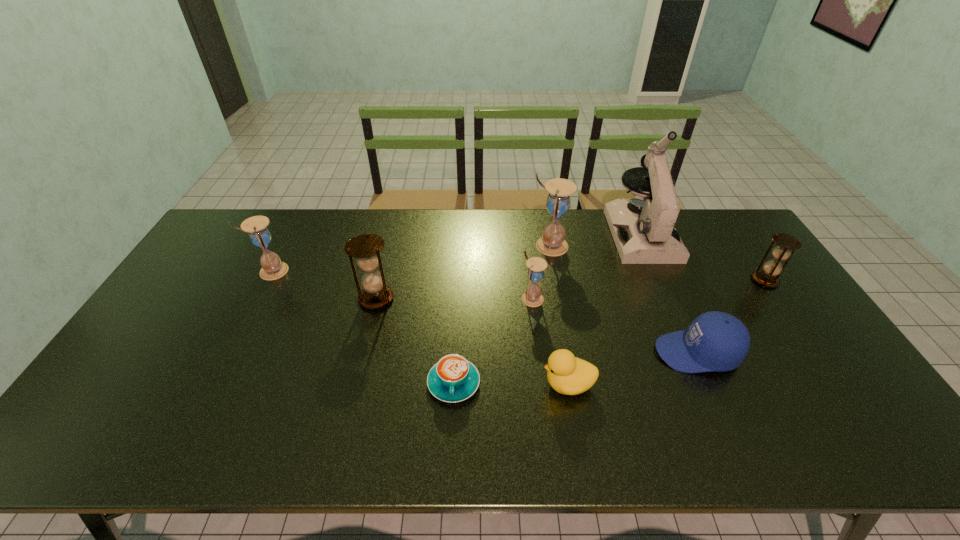
The width and height of the screenshot is (960, 540). I want to click on the tallest object, so click(643, 229).

Find the location of a particular element. the eighth shortest object is located at coordinates (552, 243).

Where is `the farthest white hourglass`? This screenshot has width=960, height=540. the farthest white hourglass is located at coordinates (552, 243).

This screenshot has height=540, width=960. I want to click on the left brown hourglass, so click(x=366, y=248).

This screenshot has height=540, width=960. In order to click on the fourth hourglass from right to left in this screenshot , I will do `click(366, 248)`.

Where is `the leftmost object`? The image size is (960, 540). the leftmost object is located at coordinates (273, 268).

Identify the location of the leftmost hourglass. (273, 268).

Where is `the smallest white hourglass`? This screenshot has width=960, height=540. the smallest white hourglass is located at coordinates (532, 297).

You are a GUI agent. You are given a task and a screenshot of the screen. Output one action in this format:
    pyautogui.click(x=<x>, y=<y>)
    Task: Click on the right brown hourglass
    The height and width of the screenshot is (540, 960).
    Given the screenshot: What is the action you would take?
    pyautogui.click(x=768, y=277)

Locate an element on the screen. The height and width of the screenshot is (540, 960). the smaller brown hourglass is located at coordinates (768, 277).